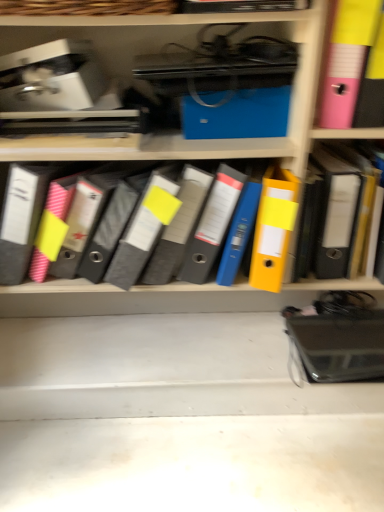
Question: Is matte gray binder at center at the left side of yellow matte folder at right?

Choices:
 (A) yes
 (B) no

Answer: (A)

Question: Is matte gray binder at center thinner than yellow matte folder at right?

Choices:
 (A) yes
 (B) no

Answer: (B)

Question: Does matte gray binder at center have a lesser height compared to yellow matte folder at right?

Choices:
 (A) no
 (B) yes

Answer: (B)

Question: Is matte gray binder at center placed right next to yellow matte folder at right?

Choices:
 (A) no
 (B) yes

Answer: (A)

Question: Can you confirm if matte gray binder at center is positioned to the right of yellow matte folder at right?

Choices:
 (A) yes
 (B) no

Answer: (B)

Question: Considering the positions of matte gray binder at center and yellow matte folder at right in the image, is matte gray binder at center wider or thinner than yellow matte folder at right?

Choices:
 (A) thin
 (B) wide

Answer: (B)

Question: Is matte gray binder at center taller or shorter than yellow matte folder at right?

Choices:
 (A) short
 (B) tall

Answer: (A)

Question: Considering the positions of point (206, 242) and point (359, 189), is point (206, 242) closer or farther from the camera than point (359, 189)?

Choices:
 (A) farther
 (B) closer

Answer: (A)

Question: From a real-world perspective, is matte gray binder at center above or below yellow matte folder at right?

Choices:
 (A) below
 (B) above

Answer: (A)

Question: In the image, is pink plastic bin at upper right positioned in front of or behind matte gray binder at center?

Choices:
 (A) front
 (B) behind

Answer: (A)

Question: Is pink plastic bin at upper right wider or thinner than matte gray binder at center?

Choices:
 (A) thin
 (B) wide

Answer: (B)

Question: From a real-world perspective, relative to matte gray binder at center, is pink plastic bin at upper right vertically above or below?

Choices:
 (A) below
 (B) above

Answer: (B)

Question: Is point (365, 38) closer or farther from the camera than point (114, 230)?

Choices:
 (A) closer
 (B) farther

Answer: (A)

Question: From the image's perspective, is yellow matte folder at right positioned above or below matte gray binder at center?

Choices:
 (A) above
 (B) below

Answer: (A)

Question: Is yellow matte folder at right inside the boundaries of matte gray binder at center, or outside?

Choices:
 (A) inside
 (B) outside

Answer: (B)